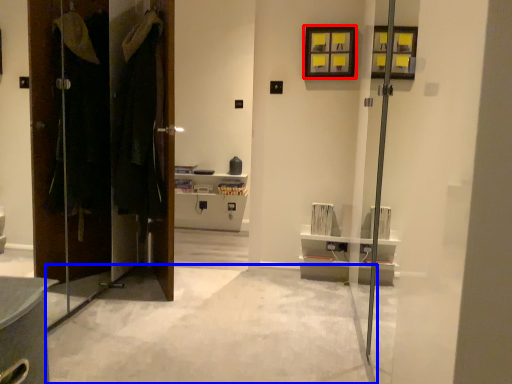
Question: Which object appears farthest to the camera in this image, window (highlighted by a red box) or concrete (highlighted by a blue box)?

Choices:
 (A) window
 (B) concrete

Answer: (A)